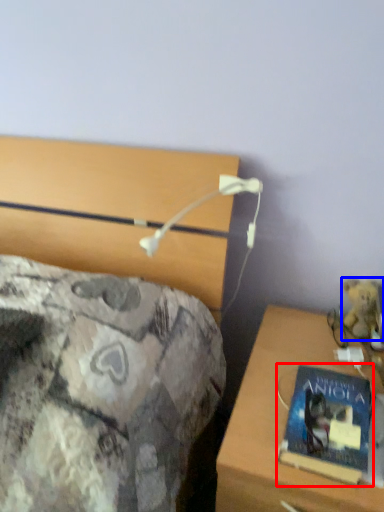
Question: Which of the following is the farthest to the observer, book (highlighted by a red box) or teddy bear (highlighted by a blue box)?

Choices:
 (A) book
 (B) teddy bear

Answer: (B)